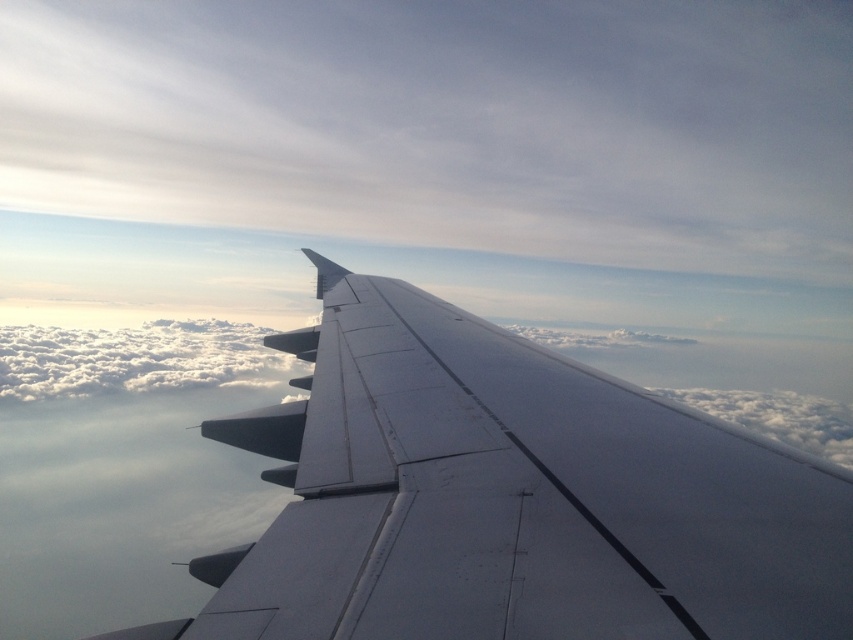
From the picture: Between white fluffy cloud at upper center and white fluffy cloud at center, which one has more height?

white fluffy cloud at upper center

Image resolution: width=853 pixels, height=640 pixels. Describe the element at coordinates (448, 124) in the screenshot. I see `white fluffy cloud at upper center` at that location.

Image resolution: width=853 pixels, height=640 pixels. I want to click on white fluffy cloud at upper center, so click(x=448, y=124).

Does metallic gray wing at center appear under white fluffy cloud at upper right?

Incorrect, metallic gray wing at center is not positioned below white fluffy cloud at upper right.

Between metallic gray wing at center and white fluffy cloud at upper right, which one is positioned lower?

Positioned lower is white fluffy cloud at upper right.

Is point (701, 605) farther from camera compared to point (750, 432)?

No.

Find the location of a particular element. This screenshot has height=640, width=853. metallic gray wing at center is located at coordinates (509, 497).

Can you confirm if white fluffy cloud at center is smaller than white fluffy cloud at upper right?

Indeed, white fluffy cloud at center has a smaller size compared to white fluffy cloud at upper right.

How far apart are white fluffy cloud at center and white fluffy cloud at upper right?

white fluffy cloud at center is 460.58 meters away from white fluffy cloud at upper right.

Does point (148, 369) come in front of point (788, 396)?

Yes, it is in front of point (788, 396).

In order to click on white fluffy cloud at center in this screenshot , I will do `click(135, 358)`.